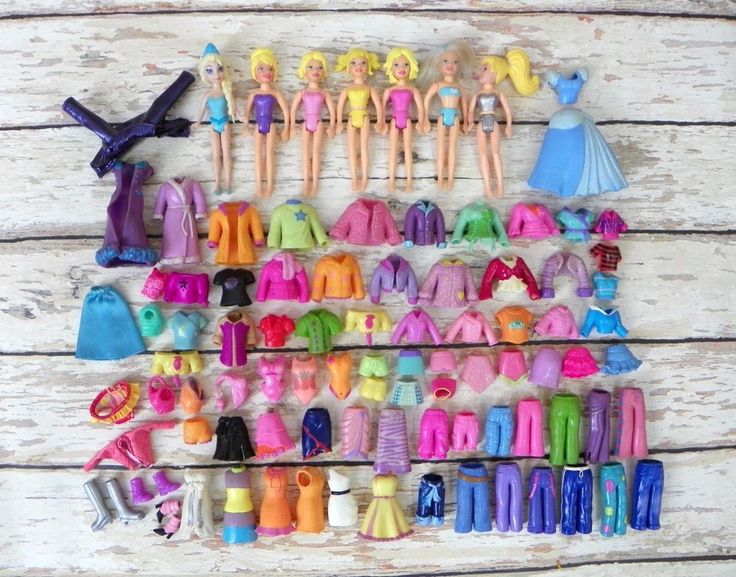
Where is `dolls`? dolls is located at coordinates (221, 108), (263, 106), (311, 101), (360, 98), (402, 96), (449, 93), (486, 100).